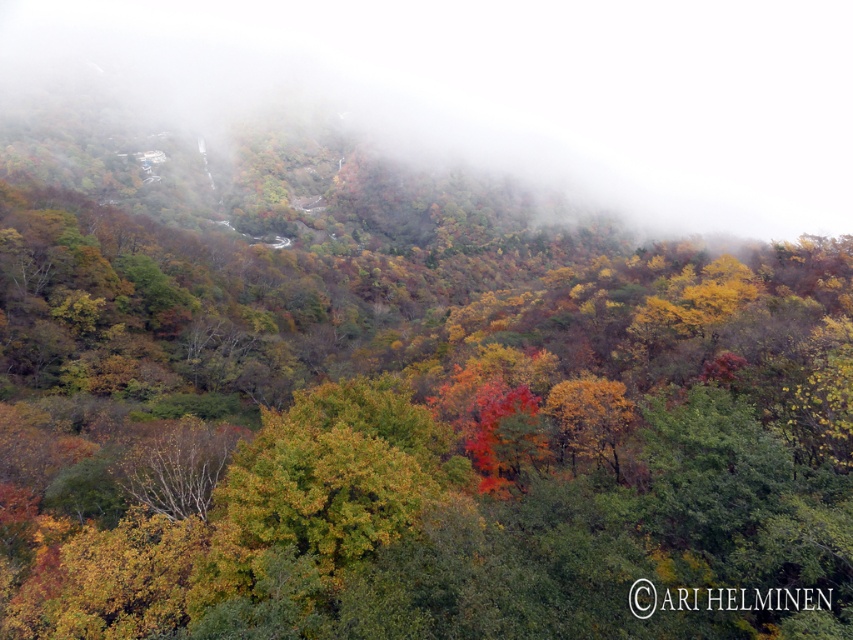
Can you confirm if foggy translucent mist at upper left is smaller than golden yellow leaves at center?

No.

The height and width of the screenshot is (640, 853). In order to click on foggy translucent mist at upper left in this screenshot , I will do `click(500, 92)`.